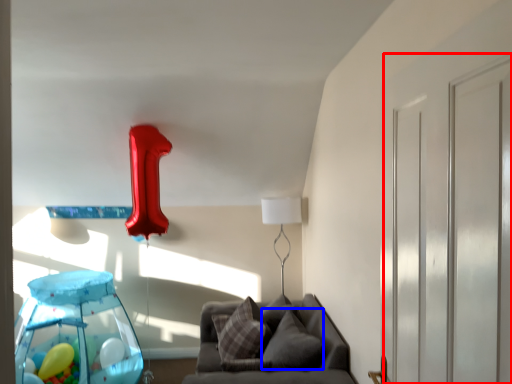
Question: Which object appears closest to the camera in this image, glass door (highlighted by a red box) or pillow (highlighted by a blue box)?

Choices:
 (A) glass door
 (B) pillow

Answer: (A)